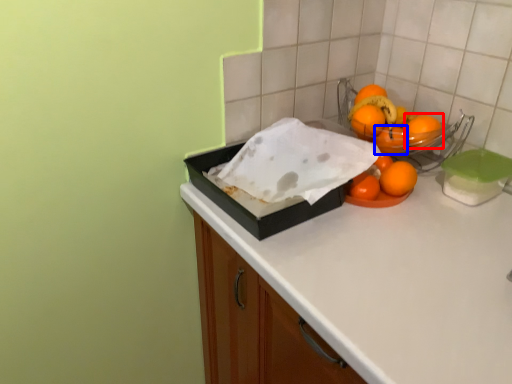
Question: Which object appears closest to the camera in this image, orange (highlighted by a red box) or orange (highlighted by a blue box)?

Choices:
 (A) orange
 (B) orange

Answer: (A)